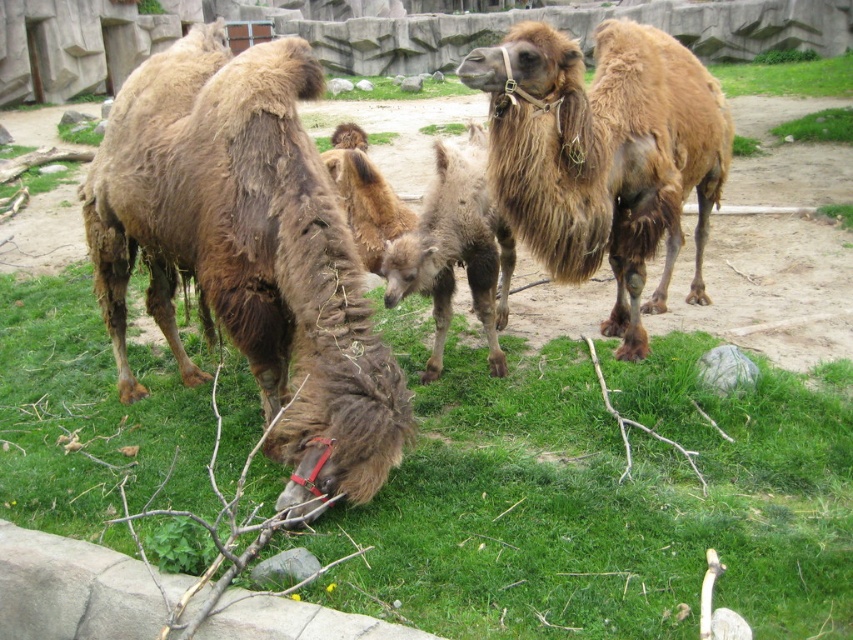
Question: Which point is farther from the camera taking this photo?

Choices:
 (A) (160, 144)
 (B) (451, 227)
 (C) (544, 96)

Answer: (B)

Question: Considering the real-world distances, which object is closest to the brown fuzzy camel at left?

Choices:
 (A) brown fuzzy camel at upper right
 (B) fuzzy brown camel at center
 (C) green grass at lower left

Answer: (C)

Question: Is green grass at lower left bigger than brown fuzzy camel at upper right?

Choices:
 (A) no
 (B) yes

Answer: (B)

Question: Which point is closer to the camera taking this photo?

Choices:
 (A) (630, 276)
 (B) (302, 48)
 (C) (242, 376)

Answer: (B)

Question: Can you confirm if green grass at lower left is wider than brown fuzzy camel at left?

Choices:
 (A) yes
 (B) no

Answer: (A)

Question: Can you confirm if green grass at lower left is positioned below brown fuzzy camel at left?

Choices:
 (A) no
 (B) yes

Answer: (B)